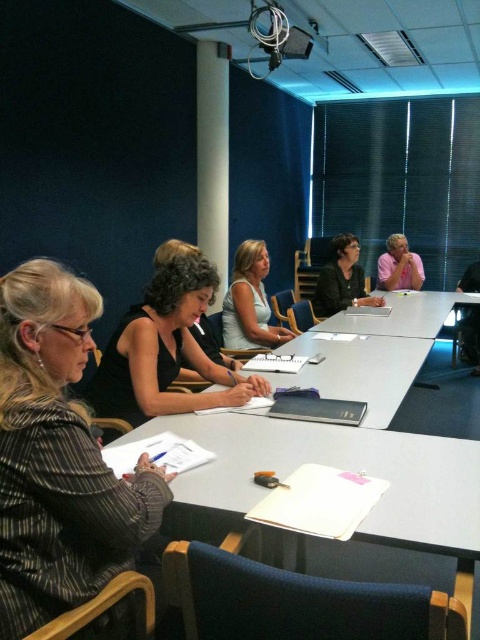
You are a conference room attendee who needs to pass a document to the person sitting at point (408, 388). If your arm can reach 1.8 meters, can you reach them without moving from your current position?

The distance between you and the person at point (408, 388) is 2.34 meters, which is longer than your arm reach of 1.8 meters. Therefore, you cannot reach them without moving.

You are sitting at the conference table and want to reach both the point at coordinates (71, 403) and the point at coordinates (225, 381). Which point should you reach for first if you want to grab the nearest one?

You should reach for point (71, 403) first because it is closer to you than point (225, 381).